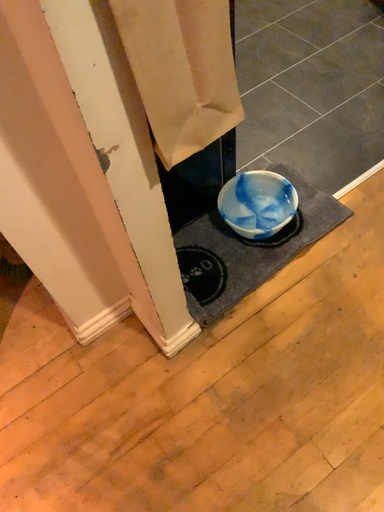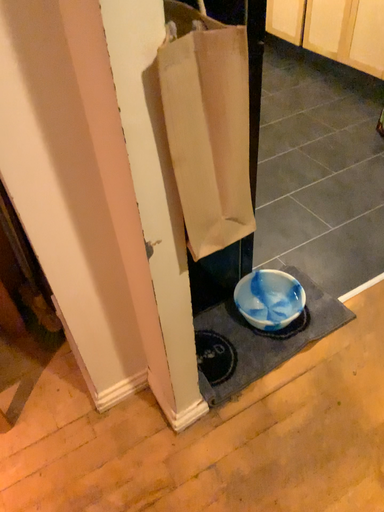
Question: How did the camera likely rotate when shooting the video?

Choices:
 (A) rotated upward
 (B) rotated downward

Answer: (A)